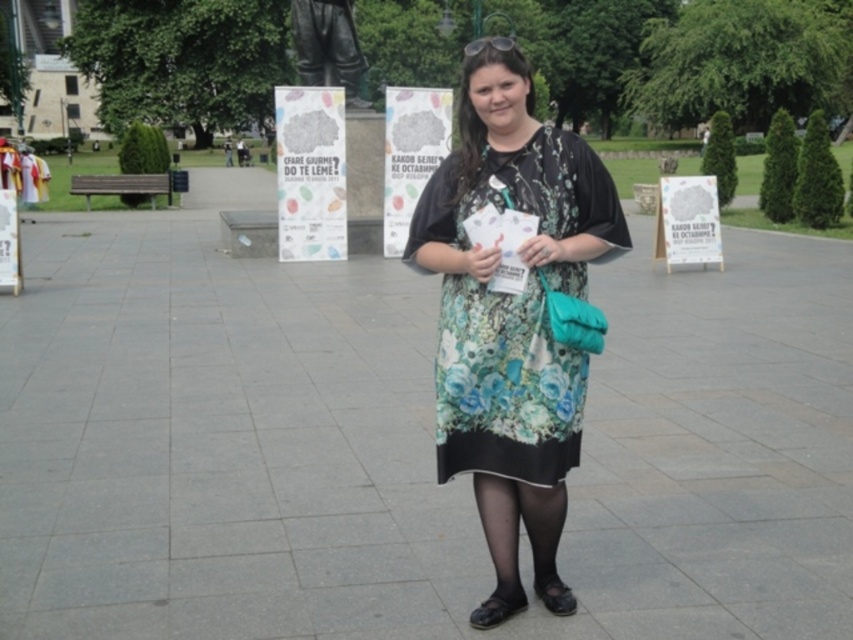
You are standing at point (340, 0) and want to walk to the statue in the background. Is the point (543, 365) blocking your path?

Point (543, 365) is in front of point (340, 0), so it is blocking your path to the statue in the background.